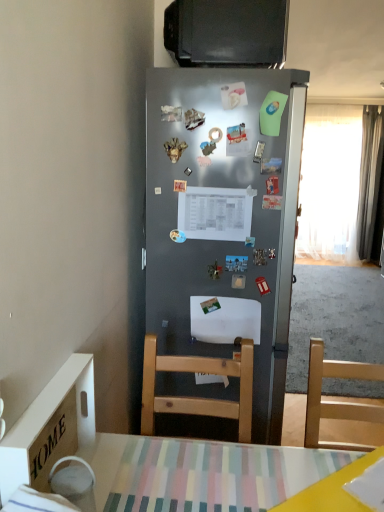
Question: Is metallic silver magnet at center, positioned as the eighth magnet in bottom-to-top order, not near metallic rectangular magnet at center, the eighth magnet from the top?

Choices:
 (A) no
 (B) yes

Answer: (A)

Question: Considering the relative sizes of metallic silver magnet at center, positioned as the eighth magnet in bottom-to-top order, and metallic rectangular magnet at center, which is counted as the 4th magnet, starting from the bottom, in the image provided, is metallic silver magnet at center, positioned as the eighth magnet in bottom-to-top order, shorter than metallic rectangular magnet at center, which is counted as the 4th magnet, starting from the bottom,?

Choices:
 (A) no
 (B) yes

Answer: (A)

Question: From the image's perspective, is metallic silver magnet at center, the 4th magnet in the top-to-bottom sequence, under metallic rectangular magnet at center, which is counted as the 4th magnet, starting from the bottom?

Choices:
 (A) yes
 (B) no

Answer: (B)

Question: Is metallic silver magnet at center, positioned as the eighth magnet in bottom-to-top order, wider than metallic rectangular magnet at center, the eighth magnet from the top?

Choices:
 (A) yes
 (B) no

Answer: (A)

Question: Can you see metallic silver magnet at center, the 4th magnet in the top-to-bottom sequence, touching metallic rectangular magnet at center, which is counted as the 4th magnet, starting from the bottom?

Choices:
 (A) yes
 (B) no

Answer: (B)

Question: In terms of size, does metallic rectangular magnet at center, which appears as the 10th magnet when viewed from the top, appear bigger or smaller than metallic ring at center, which is counted as the sixth magnet, starting from the bottom?

Choices:
 (A) small
 (B) big

Answer: (A)

Question: Is metallic rectangular magnet at center, acting as the 2th magnet starting from the bottom, situated inside metallic ring at center, which is counted as the sixth magnet, starting from the bottom, or outside?

Choices:
 (A) inside
 (B) outside

Answer: (B)

Question: Is point (274, 192) positioned closer to the camera than point (213, 132)?

Choices:
 (A) closer
 (B) farther

Answer: (B)

Question: Looking at their shapes, would you say metallic rectangular magnet at center, acting as the 2th magnet starting from the bottom, is wider or thinner than metallic ring at center, the sixth magnet viewed from the top?

Choices:
 (A) thin
 (B) wide

Answer: (A)

Question: From a real-world perspective, is metallic rectangular magnet at center, which is counted as the 4th magnet, starting from the bottom, above or below metallic silver magnet at upper center, which appears as the 9th magnet when viewed from the top?

Choices:
 (A) above
 (B) below

Answer: (A)

Question: From the image's perspective, is metallic rectangular magnet at center, the eighth magnet from the top, above or below metallic silver magnet at upper center, the 3th magnet when ordered from bottom to top?

Choices:
 (A) above
 (B) below

Answer: (A)

Question: Is metallic rectangular magnet at center, which is counted as the 4th magnet, starting from the bottom, wider or thinner than metallic silver magnet at upper center, which appears as the 9th magnet when viewed from the top?

Choices:
 (A) thin
 (B) wide

Answer: (B)

Question: Is metallic rectangular magnet at center, the eighth magnet from the top, inside or outside of metallic silver magnet at upper center, the 3th magnet when ordered from bottom to top?

Choices:
 (A) inside
 (B) outside

Answer: (B)

Question: In terms of height, does light wood chair at lower right look taller or shorter compared to silky gray curtain at right, acting as the first curtain starting from the right?

Choices:
 (A) tall
 (B) short

Answer: (B)

Question: Considering the relative positions of light wood chair at lower right and silky gray curtain at right, acting as the first curtain starting from the right, in the image provided, is light wood chair at lower right to the left or to the right of silky gray curtain at right, acting as the first curtain starting from the right,?

Choices:
 (A) right
 (B) left

Answer: (B)